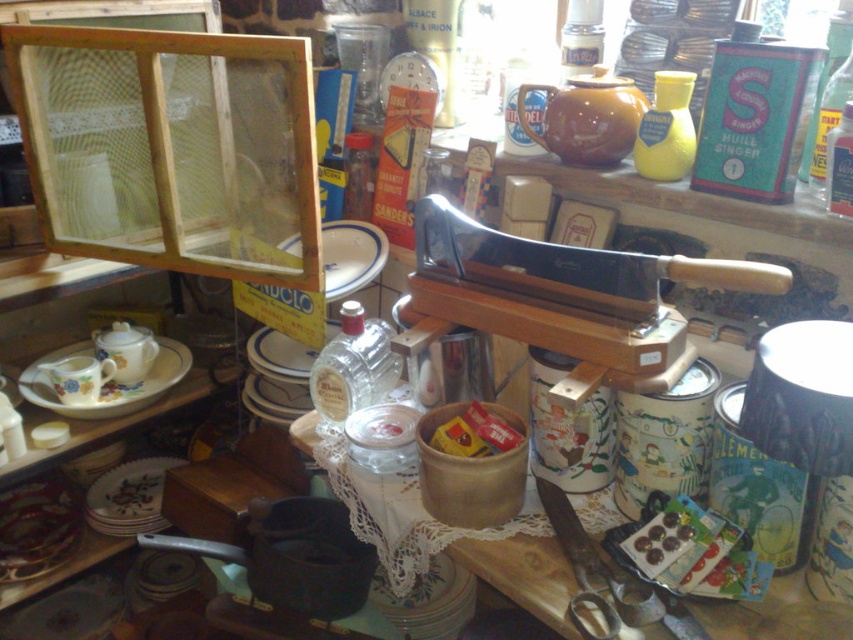
You are organizing a display of plates for a vintage shop. You have a floral ceramic plate at center and a white porcelain plate at center. According to the scene, which plate is positioned to the left?

The floral ceramic plate at center is positioned to the left of the white porcelain plate at center.

You are arranging dishes on a table and need to place the wooden cutting board at center and the white porcelain plate at center. According to the scene, which object should you place first to ensure proper positioning?

The wooden cutting board at center is closer to the viewer than the white porcelain plate at center, so you should place the wooden cutting board at center first to ensure it appears in front.